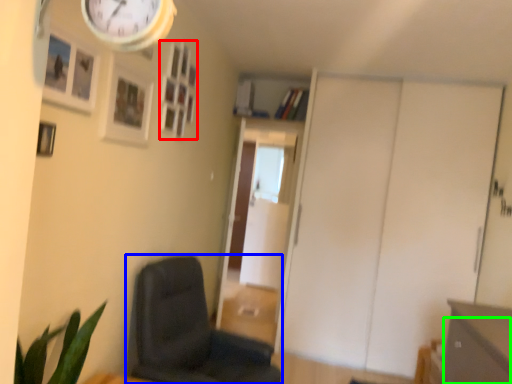
Question: Which object is the closest to the picture frame (highlighted by a red box)? Choose among these: chair (highlighted by a blue box) or drawer (highlighted by a green box).

Choices:
 (A) chair
 (B) drawer

Answer: (A)